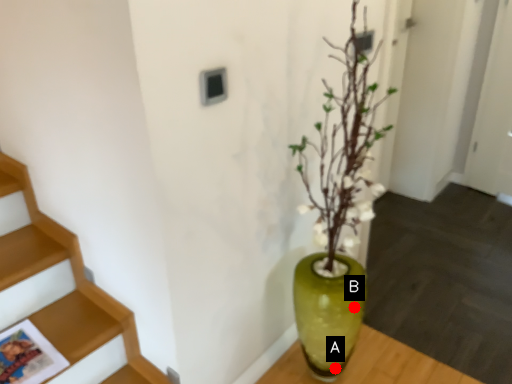
Question: Two points are circled on the image, labeled by A and B beside each circle. Which point is farther from the camera taking this photo?

Choices:
 (A) A is further
 (B) B is further

Answer: (A)